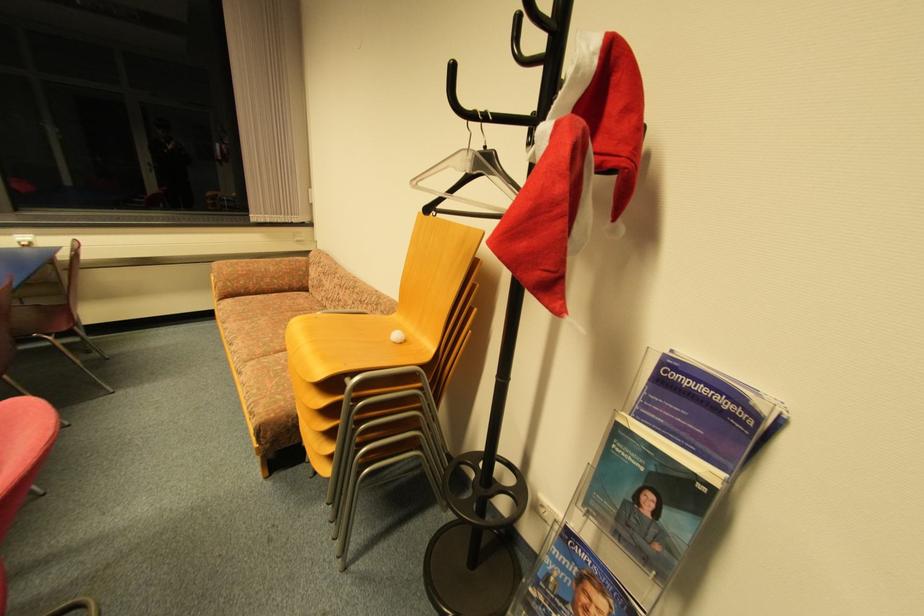
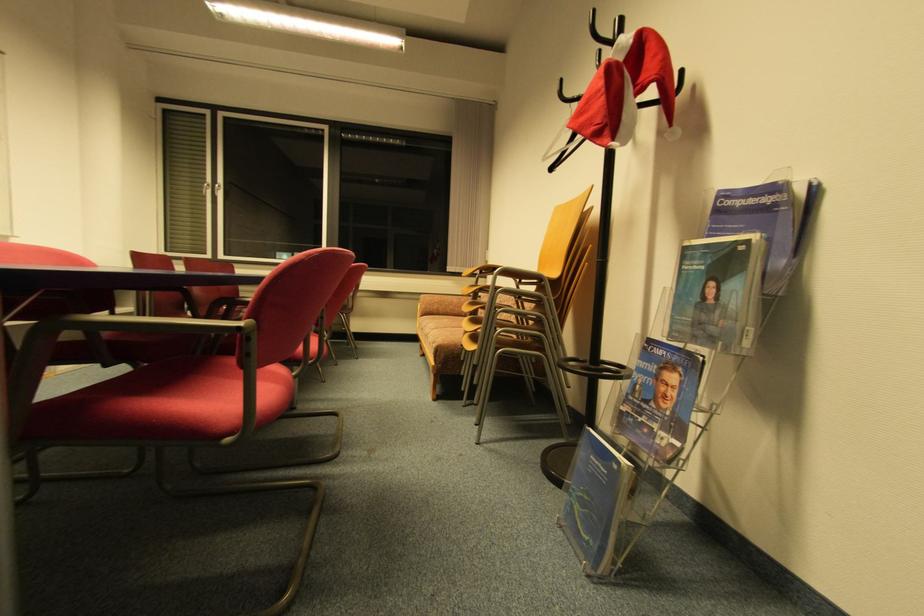
Based on the photo, the first image is from the beginning of the video and the second image is from the end. How did the camera likely rotate when shooting the video?

The camera's rotation is toward left-up.